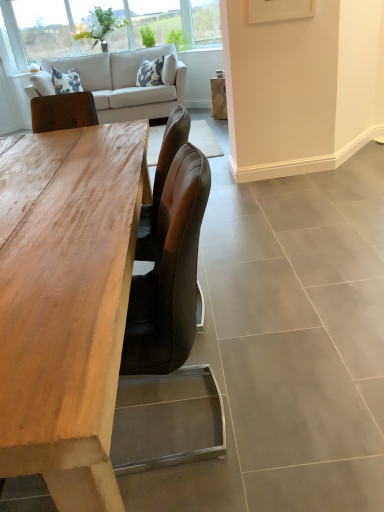
Question: Is light beige fabric couch at upper left taller or shorter than wooden table at center?

Choices:
 (A) tall
 (B) short

Answer: (A)

Question: From a real-world perspective, relative to wooden table at center, is light beige fabric couch at upper left vertically above or below?

Choices:
 (A) below
 (B) above

Answer: (B)

Question: Which object is positioned farthest from the clear glass window at upper left?

Choices:
 (A) wooden table at center
 (B) light beige fabric couch at upper left

Answer: (A)

Question: Based on their relative distances, which object is nearer to the wooden table at center?

Choices:
 (A) light beige fabric couch at upper left
 (B) clear glass window at upper left

Answer: (A)